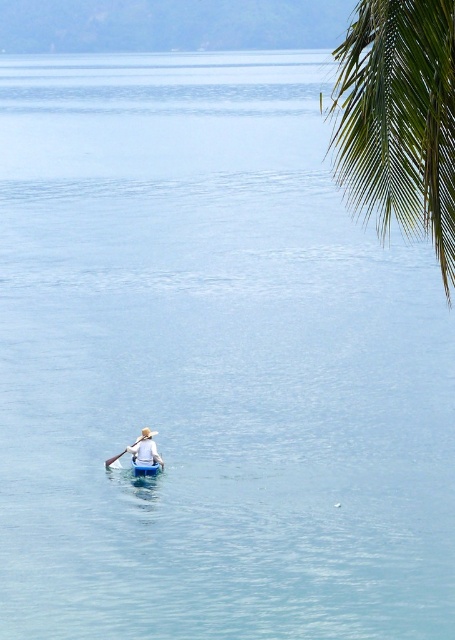
Question: Among these objects, which one is nearest to the camera?

Choices:
 (A) light blue fabric shirt at center
 (B) green leafy palm tree at upper right
 (C) blue plastic canoe at center

Answer: (B)

Question: Is light blue fabric shirt at center smaller than blue plastic canoe at center?

Choices:
 (A) yes
 (B) no

Answer: (B)

Question: Which of the following is the closest to the observer?

Choices:
 (A) green leafy palm tree at upper right
 (B) light blue fabric shirt at center
 (C) blue plastic canoe at center

Answer: (A)

Question: Is green leafy palm tree at upper right further to camera compared to light blue fabric shirt at center?

Choices:
 (A) yes
 (B) no

Answer: (B)

Question: Which object is the closest to the blue plastic canoe at center?

Choices:
 (A) light blue fabric shirt at center
 (B) green leafy palm tree at upper right

Answer: (A)

Question: Is green leafy palm tree at upper right above light blue fabric shirt at center?

Choices:
 (A) yes
 (B) no

Answer: (A)